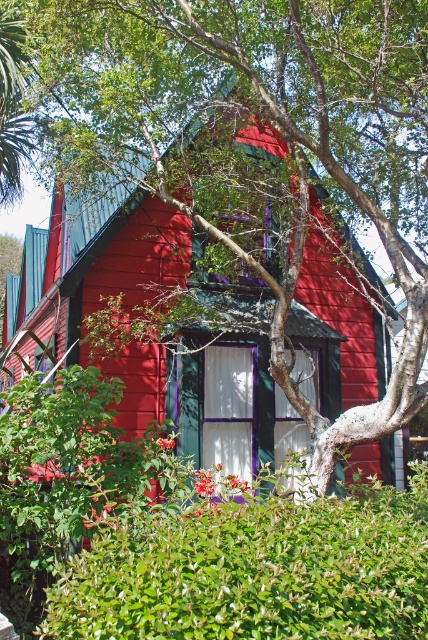
Does green leafy hedge at center appear on the left side of matte wood house at center?

Incorrect, green leafy hedge at center is not on the left side of matte wood house at center.

Who is more forward, (165, 509) or (127, 413)?

Positioned in front is point (165, 509).

Is point (0, 445) closer to viewer compared to point (142, 380)?

That is True.

At what (x,y) coordinates should I click in order to perform the action: click on green leafy hedge at center. Please return your answer as a coordinate pair (x, y). Image resolution: width=428 pixels, height=640 pixels. Looking at the image, I should click on pos(187,538).